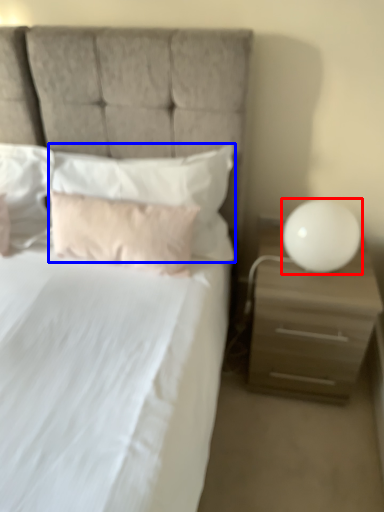
Question: Which object appears farthest to the camera in this image, table lamp (highlighted by a red box) or pillow (highlighted by a blue box)?

Choices:
 (A) table lamp
 (B) pillow

Answer: (B)